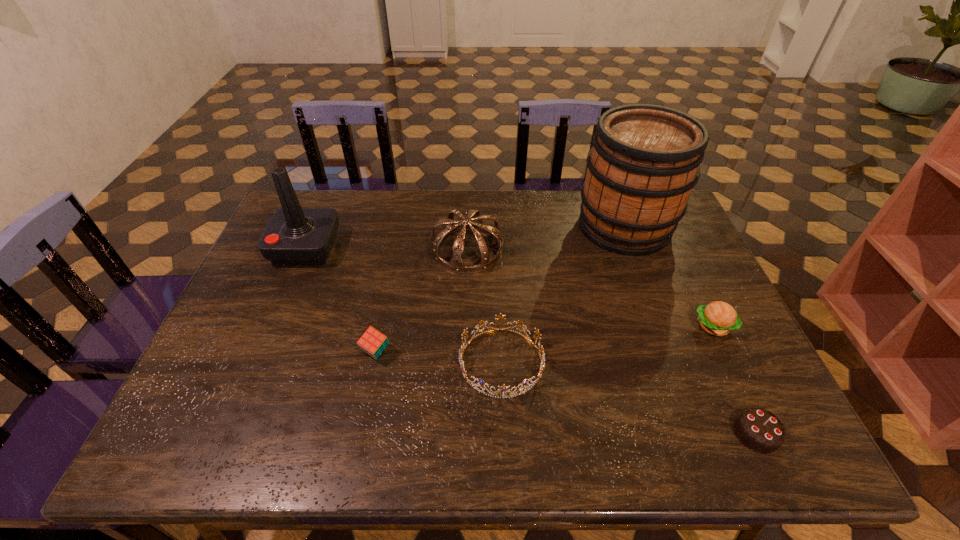
This screenshot has height=540, width=960. In the image, there is a desktop. In order to click on blank space at the right edge in this screenshot , I will do `click(696, 300)`.

Where is `blank area at the far left corner`? Image resolution: width=960 pixels, height=540 pixels. blank area at the far left corner is located at coordinates (314, 192).

At what (x,y) coordinates should I click in order to perform the action: click on vacant space in between the shorter tiara and the cube. Please return your answer as a coordinate pair (x, y). The width and height of the screenshot is (960, 540). Looking at the image, I should click on (439, 357).

Find the location of a particular element. free point between the nearer tiara and the chocolate cake is located at coordinates (629, 398).

Find the location of `vacant space that is in between the nearer tiara and the tallest object`. vacant space that is in between the nearer tiara and the tallest object is located at coordinates (563, 294).

You are a GUI agent. You are given a task and a screenshot of the screen. Output one action in this format:
    pyautogui.click(x=<x>, y=<y>)
    Task: Click on the vacant space that's between the cider and the hamburger
    
    Given the screenshot: What is the action you would take?
    pyautogui.click(x=669, y=276)

Where is `free area in between the hamburger and the leftmost object`? This screenshot has height=540, width=960. free area in between the hamburger and the leftmost object is located at coordinates (510, 287).

Find the location of a particular element. empty location between the cider and the nearest object is located at coordinates (690, 330).

Image resolution: width=960 pixels, height=540 pixels. Identify the location of free space that is in between the nearer tiara and the hamburger. (608, 345).

Where is `vacant space that's between the chocolate cake and the farther tiara`? The image size is (960, 540). vacant space that's between the chocolate cake and the farther tiara is located at coordinates (612, 342).